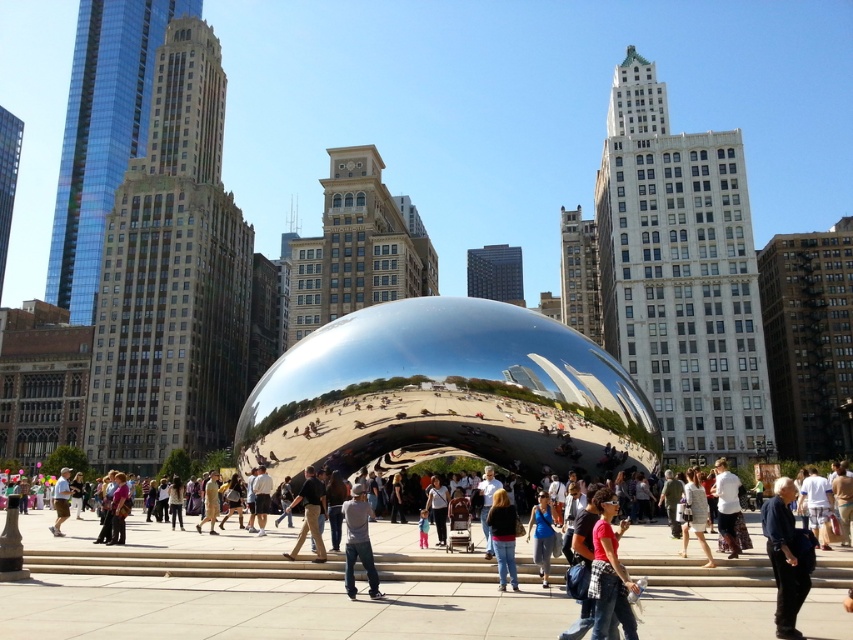
The image size is (853, 640). Describe the element at coordinates (358, 541) in the screenshot. I see `dark gray jeans at center` at that location.

Who is more distant from viewer, (354, 557) or (502, 584)?

The point (502, 584) is behind.

Is point (363, 564) farther from viewer compared to point (509, 508)?

No, it is in front of (509, 508).

The image size is (853, 640). Find the location of `dark gray jeans at center`. dark gray jeans at center is located at coordinates (358, 541).

Can you confirm if dark blue shirt at lower right is thinner than dark gray jeans at center?

In fact, dark blue shirt at lower right might be wider than dark gray jeans at center.

This screenshot has height=640, width=853. Identify the location of dark blue shirt at lower right. (786, 556).

Find the location of a particular element. The height and width of the screenshot is (640, 853). dark blue shirt at lower right is located at coordinates (786, 556).

Is the position of dark gray jeans at center more distant than that of dark brown leather pants at center?

That is False.

Looking at this image, which is below, dark gray jeans at center or dark brown leather pants at center?

dark brown leather pants at center

This screenshot has height=640, width=853. In order to click on dark gray jeans at center in this screenshot , I will do `click(358, 541)`.